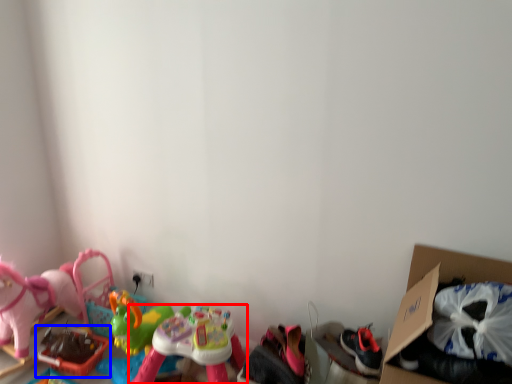
Question: Among these objects, which one is nearest to the camera, toy (highlighted by a red box) or toy (highlighted by a blue box)?

Choices:
 (A) toy
 (B) toy

Answer: (A)